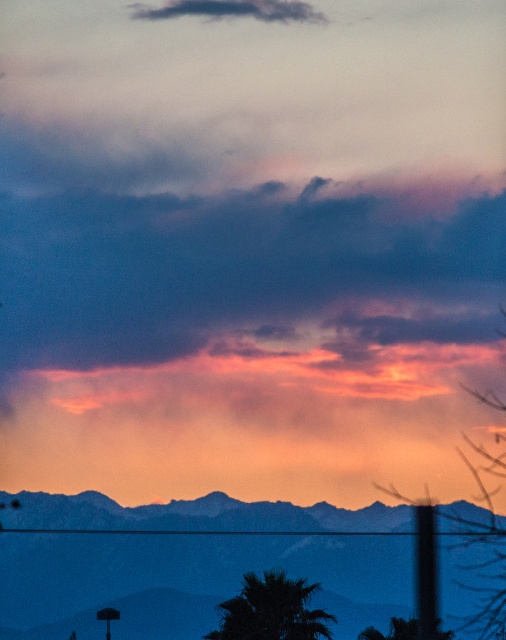
You are an astronomer observing the sunset scene. You notice the silhouetted rocky mountains at lower center and the cloudy sky at upper center. Which object appears taller in the image?

The silhouetted rocky mountains at lower center appears taller than the cloudy sky at upper center in the image.

Based on the photo, you are an astronomer observing the sunset scene. You notice two mountain ranges in the image. Which mountain range, the silvery metallic mountains at center or the silhouetted rocky mountains at lower center, is positioned lower in the image?

The silvery metallic mountains at center is positioned lower in the image than the silhouetted rocky mountains at lower center.

You are an astronomer analyzing the sunset image. You need to locate the dark purple cloud at upper center. What are its coordinates?

The dark purple cloud at upper center is located at coordinates point (243, 269).